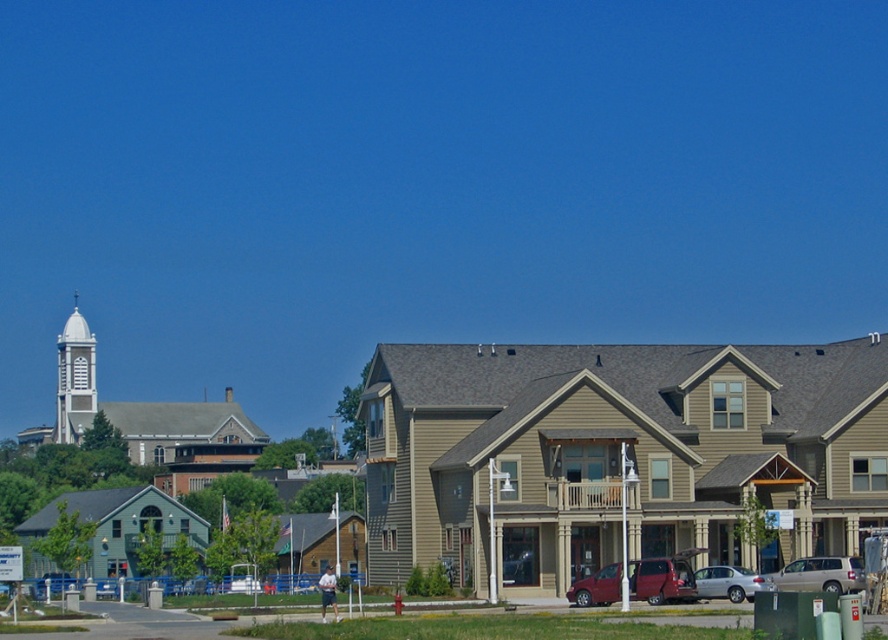
You are a drone operator trying to capture a photo of the white stucco spire at upper left. The camera is currently positioned at point A, which is at coordinates 0.5, 0.1. To ensure the spire is centered in the photo, should you move the camera slightly to the left or to the right?

The white stucco spire at upper left is located at point (74, 378). Since the camera is at (88, 320), it needs to move slightly to the right to align with the spire at 0.592 on the x axis. The y coordinate is close enough, so focus on adjusting the x position.

You are standing in the suburban scene and want to locate the point at coordinates point (74, 378). Where would you look?

The point (74, 378) is on the white stucco spire at upper left.